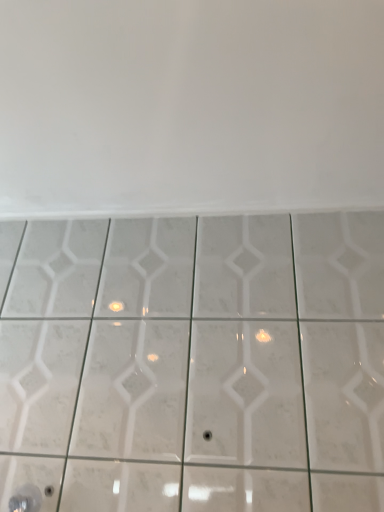
What do you see at coordinates (26, 499) in the screenshot?
I see `transparent plastic faucet at lower left` at bounding box center [26, 499].

Locate an element on the screen. The width and height of the screenshot is (384, 512). transparent plastic faucet at lower left is located at coordinates (26, 499).

You are a GUI agent. You are given a task and a screenshot of the screen. Output one action in this format:
    pyautogui.click(x=<x>, y=<y>)
    Task: Click on the transparent plastic faucet at lower left
    The width and height of the screenshot is (384, 512).
    Given the screenshot: What is the action you would take?
    pyautogui.click(x=26, y=499)